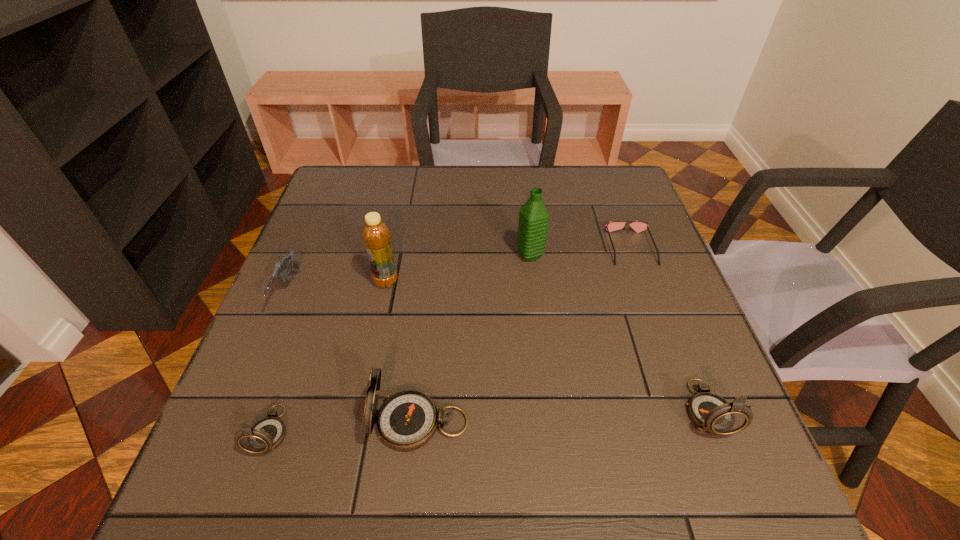
You are a GUI agent. You are given a task and a screenshot of the screen. Output one action in this format:
    pyautogui.click(x=<x>, y=<y>)
    Task: Click on the vacant space located on the face of the third tallest object
    The image size is (960, 540).
    Given the screenshot: What is the action you would take?
    pyautogui.click(x=243, y=423)

Find the location of a particular element. This screenshot has height=540, width=960. vacant space located on the face of the third tallest object is located at coordinates (221, 423).

Where is `vacant region located on the face of the third tallest object`? vacant region located on the face of the third tallest object is located at coordinates 227,423.

Locate an element on the screen. free space located 0.340m on the front of the bottle is located at coordinates (354, 429).

Where is `vacant space located at the barrel of the gun`? The width and height of the screenshot is (960, 540). vacant space located at the barrel of the gun is located at coordinates (248, 392).

Locate an element on the screen. Image resolution: width=960 pixels, height=540 pixels. vacant space located on the back of the third object from right to left is located at coordinates (520, 173).

Where is `vacant space located 0.160m on the bridge of the sunglasses`? vacant space located 0.160m on the bridge of the sunglasses is located at coordinates (656, 316).

Where is `compass that is at the left edge`? compass that is at the left edge is located at coordinates (265, 435).

Where is `gun situated at the left edge`? gun situated at the left edge is located at coordinates (281, 268).

Where is `compass at the right edge`? The image size is (960, 540). compass at the right edge is located at coordinates (711, 413).